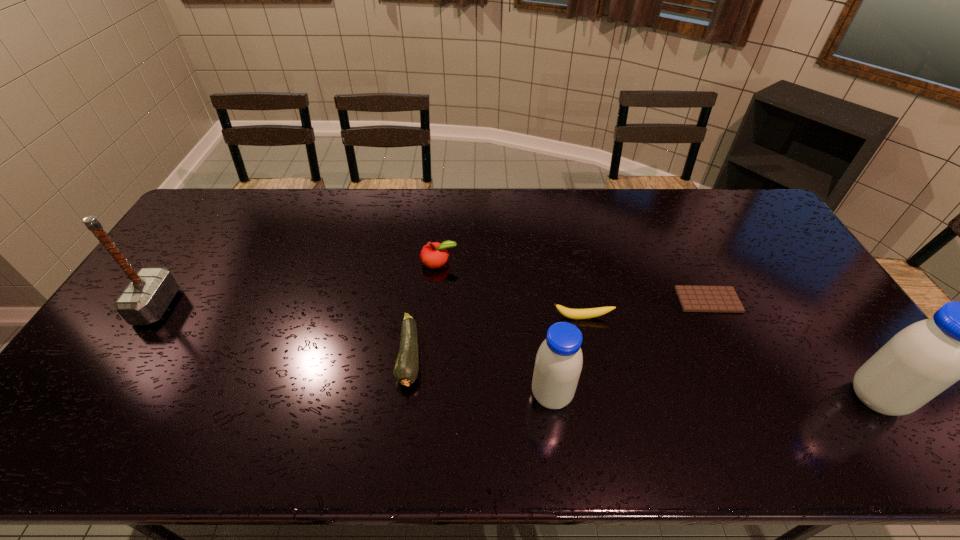
Locate an element on the screen. This screenshot has height=540, width=960. vacant place for an extra soya milk on the left is located at coordinates (230, 393).